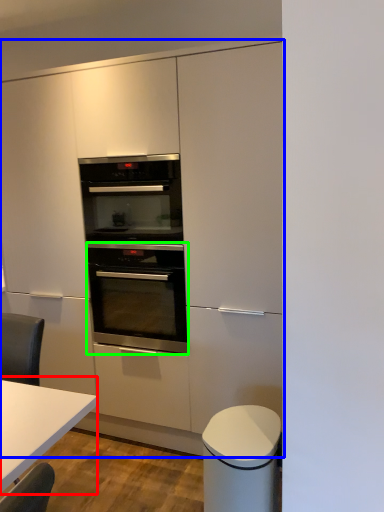
Question: Considering the real-world distances, which object is closest to table (highlighted by a red box)? cabinetry (highlighted by a blue box) or oven (highlighted by a green box).

Choices:
 (A) cabinetry
 (B) oven

Answer: (B)